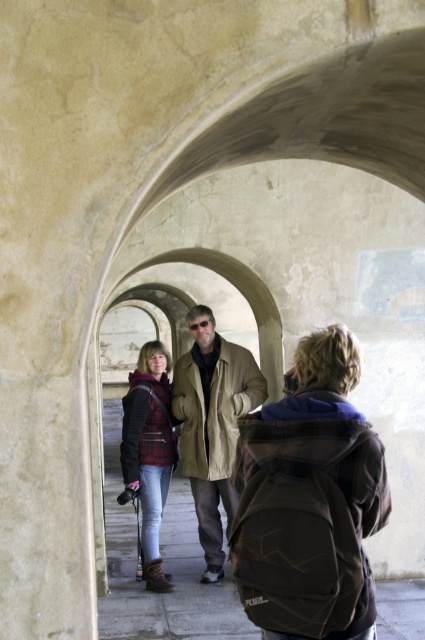
You are standing in the arched corridor and want to adjust your belongings. Which item is positioned lower on your body between the brown fabric backpack at center and the plaid fabric jacket at center?

The brown fabric backpack at center is located below the plaid fabric jacket at center, so it is positioned lower on your body.

You are standing in the arched corridor and want to place your brown fabric backpack at center and plaid fabric jacket at center on the ground. If the backpack is 0.5 meters wide, can both items fit side by side without overlapping?

The brown fabric backpack at center and plaid fabric jacket at center are 1.00 meters apart. Since the backpack is 0.5 meters wide, there is enough space between them to place both items side by side without overlapping.

You are standing in the arched corridor and see two jackets at the center. Which one is taller, the tan leather jacket at center or the plaid fabric jacket at center?

The tan leather jacket at center is taller than the plaid fabric jacket at center.